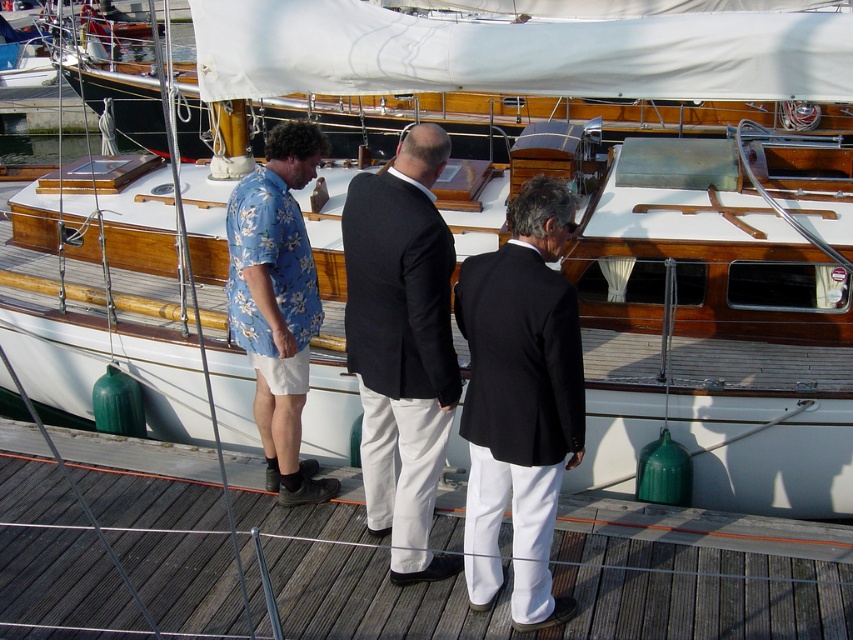
You are standing at the edge of the dock and want to take a photo of the sailboat. There are two points marked on the dock at coordinates point (x=410, y=154) and point (x=405, y=392). Which point should you stand closer to in order to get the sailboat in the center of your photo?

You should stand closer to point (x=410, y=154) because it is closer to the viewer, allowing the sailboat to be centered in your photo.

You are standing at the point marked as point (392, 611) in the marina scene. If you need to move to the dock where the three people are standing, which is 4.85 meters away from your current position, can you safely walk there without any obstacles?

Answer: Yes, you can safely walk to the dock where the three people are standing because the distance between point (392, 611) and the viewer is 4.85 meters, indicating that there is a clear path for you to move there without encountering any obstacles.